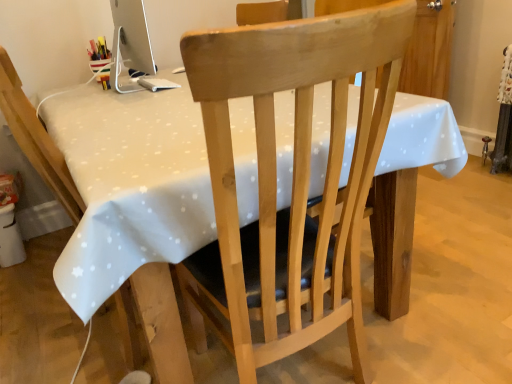
What do you see at coordinates (130, 185) in the screenshot? I see `white dotted tablecloth at center` at bounding box center [130, 185].

This screenshot has height=384, width=512. I want to click on light wood chair at center, the 2th chair positioned from the right, so click(x=154, y=323).

Between light wood chair at center, which is the 1th chair from left to right, and white glossy computer monitor at upper left, which one has smaller size?

With smaller size is white glossy computer monitor at upper left.

Consider the image. From a real-world perspective, which object rests below the other?

In real-world perspective, light wood chair at center, the 2th chair positioned from the right, is lower.

Consider the image. Which is closer to the camera, (157, 367) or (121, 33)?

Clearly, point (157, 367) is closer to the camera than point (121, 33).

Is white glossy computer monitor at upper left a part of light wood chair at center, the 2th chair positioned from the right?

No, white glossy computer monitor at upper left is not a part of light wood chair at center, the 2th chair positioned from the right.

Is white dotted tablecloth at center located within light wood chair at center, the 2th chair positioned from the right?

Actually, white dotted tablecloth at center is outside light wood chair at center, the 2th chair positioned from the right.

Identify the location of chair located on the left of white dotted tablecloth at center. (154, 323).

From the image's perspective, which one is positioned higher, light wood chair at center, which is the 1th chair from left to right, or white dotted tablecloth at center?

white dotted tablecloth at center is shown above in the image.

How many degrees apart are the facing directions of white dotted tablecloth at center and natural wood chair at center, which is the 2th chair in left-to-right order?

The angle between the facing direction of white dotted tablecloth at center and the facing direction of natural wood chair at center, which is the 2th chair in left-to-right order, is 180 degrees.

Is white dotted tablecloth at center taller or shorter than natural wood chair at center, which is the 2th chair in left-to-right order?

Considering their sizes, white dotted tablecloth at center has less height than natural wood chair at center, which is the 2th chair in left-to-right order.

Between white dotted tablecloth at center and natural wood chair at center, which is the 2th chair in left-to-right order, which one appears on the left side from the viewer's perspective?

white dotted tablecloth at center is more to the left.

From the image's perspective, is white dotted tablecloth at center located above or below natural wood chair at center, the first chair from the right?

Clearly, from the image's perspective, white dotted tablecloth at center is above natural wood chair at center, the first chair from the right.

Does natural wood chair at center, which is the 2th chair in left-to-right order, have a lesser height compared to white glossy computer monitor at upper left?

No, natural wood chair at center, which is the 2th chair in left-to-right order, is not shorter than white glossy computer monitor at upper left.

In the scene shown: Is natural wood chair at center, which is the 2th chair in left-to-right order, completely or partially outside of white glossy computer monitor at upper left?

Absolutely, natural wood chair at center, which is the 2th chair in left-to-right order, is external to white glossy computer monitor at upper left.

Is natural wood chair at center, the first chair from the right, positioned in front of white glossy computer monitor at upper left?

Yes, natural wood chair at center, the first chair from the right, is closer to the viewer.

From a real-world perspective, is natural wood chair at center, the first chair from the right, physically below white glossy computer monitor at upper left?

Yes, from a real-world perspective, natural wood chair at center, the first chair from the right, is beneath white glossy computer monitor at upper left.

Considering the positions of objects white glossy computer monitor at upper left and light wood chair at center, which is the 1th chair from left to right, in the image provided, who is behind, white glossy computer monitor at upper left or light wood chair at center, which is the 1th chair from left to right,?

white glossy computer monitor at upper left is behind.

Does white glossy computer monitor at upper left have a smaller size compared to light wood chair at center, which is the 1th chair from left to right?

Correct, white glossy computer monitor at upper left occupies less space than light wood chair at center, which is the 1th chair from left to right.

Which object is positioned more to the left, white glossy computer monitor at upper left or light wood chair at center, which is the 1th chair from left to right?

From the viewer's perspective, white glossy computer monitor at upper left appears more on the left side.

Looking at this image, would you say white glossy computer monitor at upper left is a long distance from light wood chair at center, which is the 1th chair from left to right?

That's not correct — white glossy computer monitor at upper left is a little close to light wood chair at center, which is the 1th chair from left to right.

Is white glossy computer monitor at upper left aimed at natural wood chair at center, the first chair from the right?

No, white glossy computer monitor at upper left is not turned towards natural wood chair at center, the first chair from the right.

Between white glossy computer monitor at upper left and natural wood chair at center, which is the 2th chair in left-to-right order, which one is positioned behind?

A: white glossy computer monitor at upper left is behind.

How much distance is there between white glossy computer monitor at upper left and natural wood chair at center, which is the 2th chair in left-to-right order?

white glossy computer monitor at upper left and natural wood chair at center, which is the 2th chair in left-to-right order, are 1.06 meters apart.

Between white glossy computer monitor at upper left and natural wood chair at center, which is the 2th chair in left-to-right order, which one appears on the left side from the viewer's perspective?

white glossy computer monitor at upper left.

Can you confirm if white dotted tablecloth at center is wider than light wood chair at center, which is the 1th chair from left to right?

Correct, the width of white dotted tablecloth at center exceeds that of light wood chair at center, which is the 1th chair from left to right.

In order to click on table lying above the light wood chair at center, the 2th chair positioned from the right (from the image's perspective) in this screenshot , I will do `click(130, 185)`.

Is the position of white dotted tablecloth at center less distant than that of light wood chair at center, the 2th chair positioned from the right?

Yes.

From the image's perspective, is white dotted tablecloth at center above or below light wood chair at center, the 2th chair positioned from the right?

From the image's perspective, white dotted tablecloth at center appears above light wood chair at center, the 2th chair positioned from the right.

Where is `the 1st chair to the right of the white glossy computer monitor at upper left, counting from the anchor's position`? the 1st chair to the right of the white glossy computer monitor at upper left, counting from the anchor's position is located at coordinates (154, 323).

What are the coordinates of `chair that is the 1st one when counting downward from the white dotted tablecloth at center (from the image's perspective)` in the screenshot? It's located at (154, 323).

From the image, which object appears to be nearer to white glossy computer monitor at upper left, light wood chair at center, the 2th chair positioned from the right, or natural wood chair at center, which is the 2th chair in left-to-right order?

light wood chair at center, the 2th chair positioned from the right, is positioned closer to the anchor white glossy computer monitor at upper left.

In the scene shown: When comparing their distances from white dotted tablecloth at center, does light wood chair at center, which is the 1th chair from left to right, or white glossy computer monitor at upper left seem closer?

light wood chair at center, which is the 1th chair from left to right, is positioned closer to the anchor white dotted tablecloth at center.

Based on their spatial positions, is white glossy computer monitor at upper left or natural wood chair at center, the first chair from the right, further from light wood chair at center, the 2th chair positioned from the right?

white glossy computer monitor at upper left.

Looking at the image, which one is located closer to light wood chair at center, the 2th chair positioned from the right, white dotted tablecloth at center or natural wood chair at center, the first chair from the right?

white dotted tablecloth at center is positioned closer to the anchor light wood chair at center, the 2th chair positioned from the right.

When comparing their distances from white glossy computer monitor at upper left, does natural wood chair at center, the first chair from the right, or light wood chair at center, which is the 1th chair from left to right, seem further?

natural wood chair at center, the first chair from the right, is positioned further to the anchor white glossy computer monitor at upper left.

Consider the image. Looking at the image, which one is located closer to natural wood chair at center, the first chair from the right, white glossy computer monitor at upper left or light wood chair at center, the 2th chair positioned from the right?

light wood chair at center, the 2th chair positioned from the right, lies closer to natural wood chair at center, the first chair from the right, than the other object.

Based on their spatial positions, is natural wood chair at center, the first chair from the right, or white dotted tablecloth at center closer to light wood chair at center, which is the 1th chair from left to right?

white dotted tablecloth at center lies closer to light wood chair at center, which is the 1th chair from left to right, than the other object.

Considering their positions, is light wood chair at center, which is the 1th chair from left to right, positioned further to natural wood chair at center, the first chair from the right, than white glossy computer monitor at upper left?

white glossy computer monitor at upper left.

This screenshot has width=512, height=384. I want to click on table located between natural wood chair at center, the first chair from the right, and white glossy computer monitor at upper left in the depth direction, so click(130, 185).

Image resolution: width=512 pixels, height=384 pixels. Identify the location of chair between natural wood chair at center, the first chair from the right, and white glossy computer monitor at upper left from front to back. (154, 323).

At what (x,y) coordinates should I click in order to perform the action: click on chair between white dotted tablecloth at center and white glossy computer monitor at upper left from front to back. Please return your answer as a coordinate pair (x, y). Image resolution: width=512 pixels, height=384 pixels. Looking at the image, I should click on (154, 323).

Where is `table between light wood chair at center, which is the 1th chair from left to right, and natural wood chair at center, the first chair from the right, in the horizontal direction`? table between light wood chair at center, which is the 1th chair from left to right, and natural wood chair at center, the first chair from the right, in the horizontal direction is located at coordinates (130, 185).